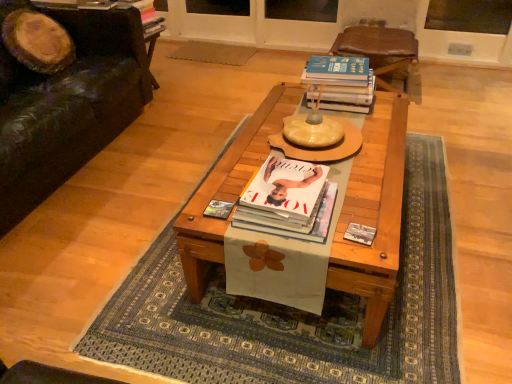
Identify the location of vacant area that lies between black leather couch at left and white paper with flower design at center. The height and width of the screenshot is (384, 512). (129, 197).